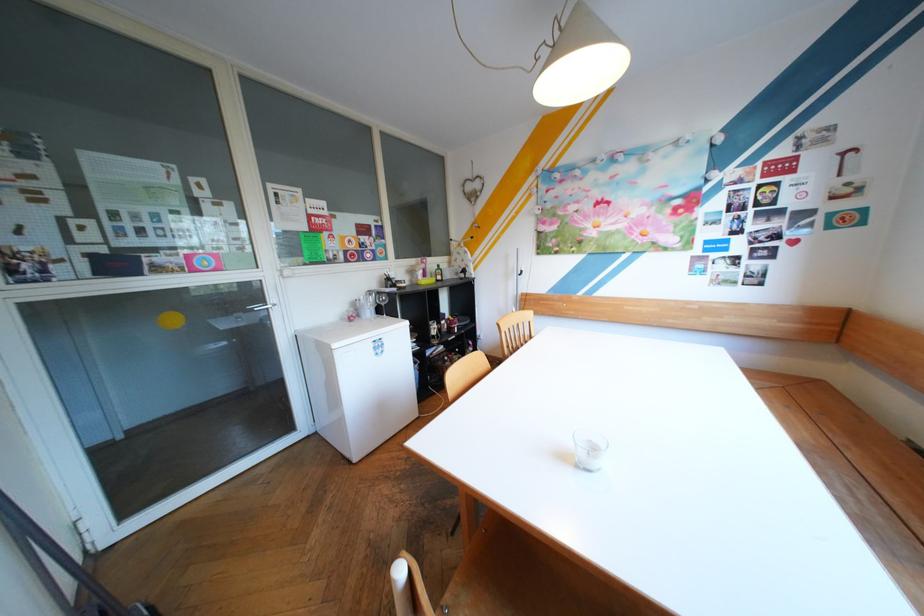
Identify the location of silver door handle. (261, 306).